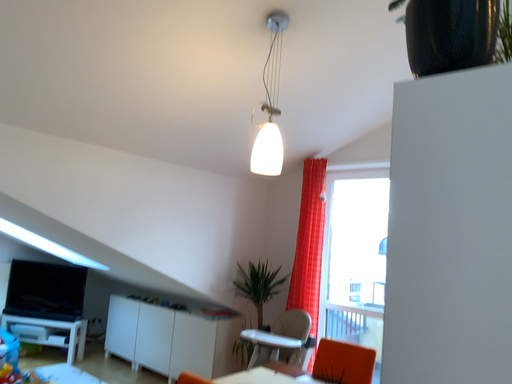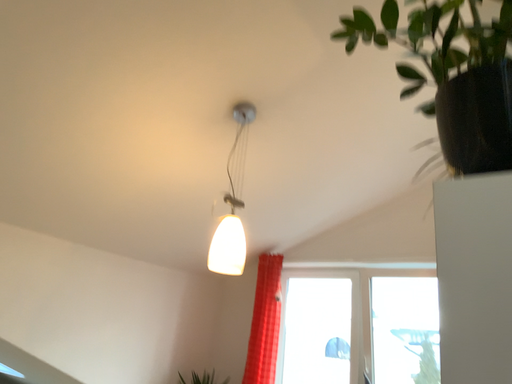
Question: Which way did the camera rotate in the video?

Choices:
 (A) rotated left
 (B) rotated right

Answer: (B)